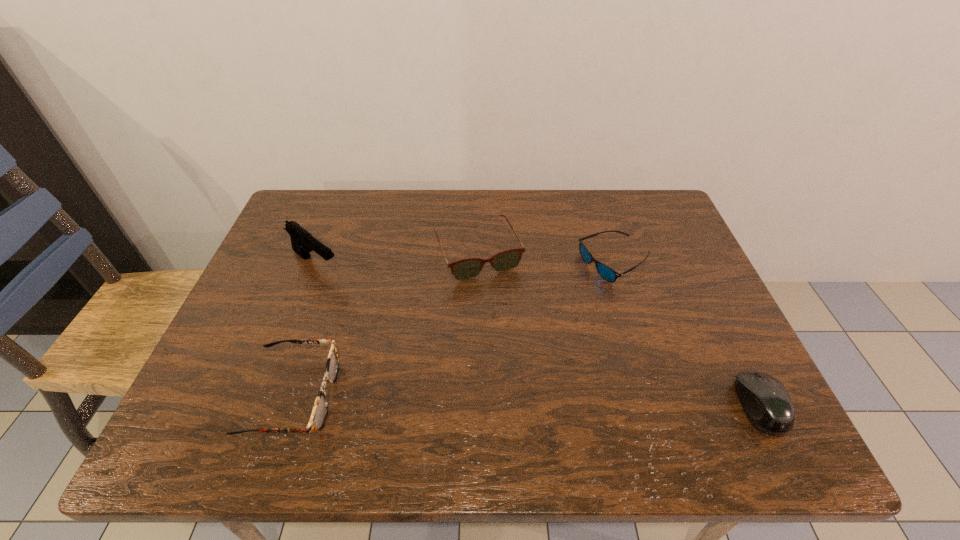
The image size is (960, 540). In order to click on free location at the right edge of the desktop in this screenshot , I will do `click(670, 282)`.

The height and width of the screenshot is (540, 960). What are the coordinates of `vacant area at the far left corner of the desktop` in the screenshot? It's located at (283, 234).

This screenshot has height=540, width=960. Identify the location of vacant region at the far right corner of the desktop. (633, 215).

This screenshot has height=540, width=960. I want to click on vacant point at the near right corner, so 679,381.

In order to click on free area in between the left spectacles and the farther spectacles in this screenshot , I will do `click(385, 325)`.

Locate an element on the screen. This screenshot has width=960, height=540. vacant region between the farther spectacles and the rightmost object is located at coordinates (619, 330).

Where is `empty space between the nearer spectacles and the rightmost object`? The width and height of the screenshot is (960, 540). empty space between the nearer spectacles and the rightmost object is located at coordinates (526, 401).

Where is `vacant area that lies between the right spectacles and the shortest object`? The height and width of the screenshot is (540, 960). vacant area that lies between the right spectacles and the shortest object is located at coordinates (546, 259).

Identify the location of vacant point located between the left spectacles and the pistol. This screenshot has height=540, width=960. (304, 330).

Find the location of a particular element. This screenshot has width=960, height=540. vacant space in between the tallest object and the mouse is located at coordinates coord(538,335).